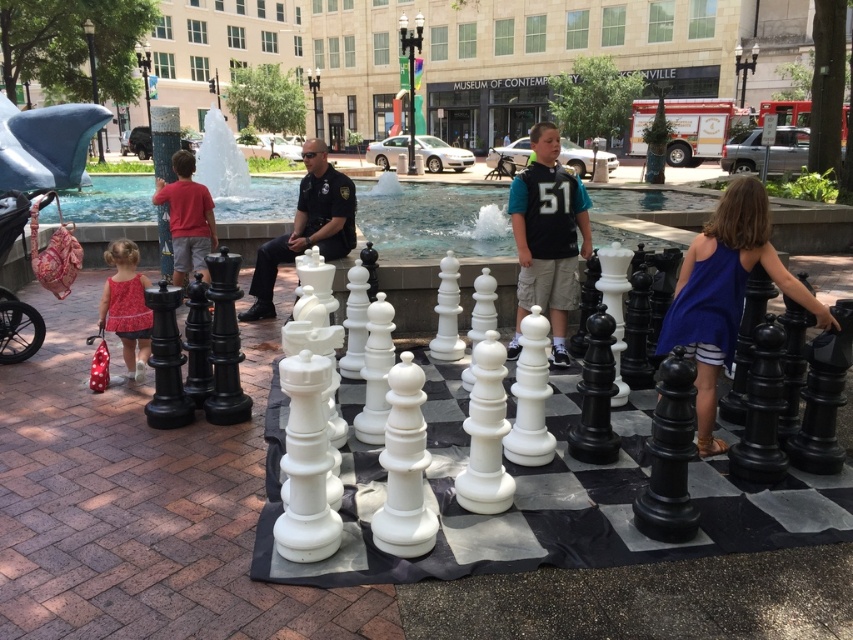
You are a photographer at the park and want to take a picture of the blue fabric dress at right and the matte black uniform at center. Which object should you focus on first if you want to capture both in the same frame without moving the camera?

The blue fabric dress at right is positioned under the matte black uniform at center, so you should focus on the matte black uniform at center first to ensure both are in focus since it is closer to the camera.

Looking at this image, you are standing at the center of the chessboard in the outdoor chess set scene. You want to move towards the blue fabric dress at right. Which direction should you walk to reach it?

Since the blue fabric dress at right is located at point 0.459 on the x and 0.851 on the y coordinate, you should walk towards the right side of the chessboard to reach it.

Consider the image. You are a photographer positioned at the center of the chessboard. You want to take a photo of both the blue fabric dress at right and the matte red dress at left. Which dress will appear closer to the camera in the photo?

The blue fabric dress at right will appear closer to the camera because it is in front of the matte red dress at left.